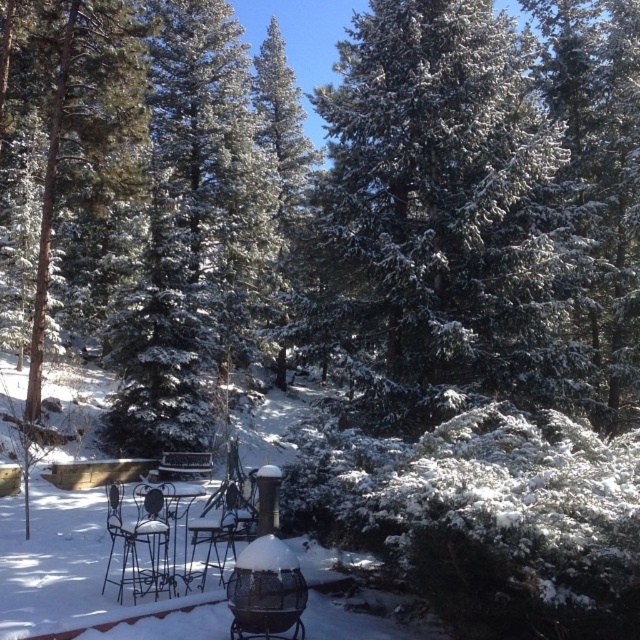
You are planning to set up a small tea station on the metallic silver table at center. You have a teapot that is 30 cm tall. Can the black wrought iron chair at center accommodate placing the teapot on its seat without it touching the ground?

The black wrought iron chair at center has a lesser height compared to metallic silver table at center. Since the teapot is 30 cm tall, if the chair seat is lower than the table, the teapot placed on the chair seat would be lower than the table. However, the question is about whether the teapot would touch the ground. The height of the chair seat itself isnecessary to determine if the teapot, when placed on it, would reach the ground. Since the chair is shorter than the table, but we donot know the exact h,

You are standing at the edge of the snowcovered patio and want to sit down. Which object at point (138, 545) is available for you to sit on?

The point (138, 545) corresponds to the black wrought iron chair at center, which is available for sitting.